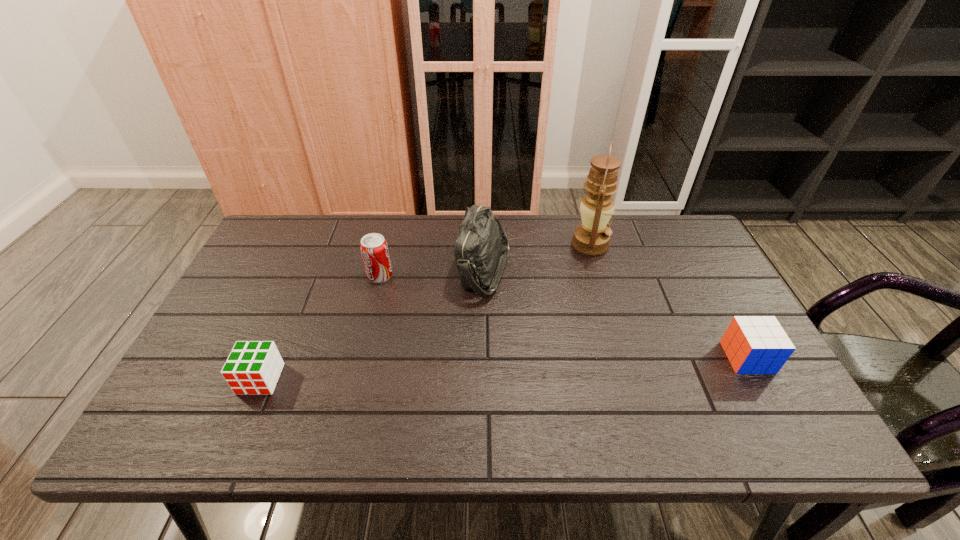
The image size is (960, 540). What are the coordinates of `the tallest object` in the screenshot? It's located at (592, 237).

At what (x,y) coordinates should I click in order to perform the action: click on oil lamp. Please return your answer as a coordinate pair (x, y). Image resolution: width=960 pixels, height=540 pixels. Looking at the image, I should click on (x=592, y=237).

This screenshot has height=540, width=960. Identify the location of the third object from left to right. point(481,250).

Where is `the fourth shortest object`? The image size is (960, 540). the fourth shortest object is located at coordinates (481, 250).

You are a GUI agent. You are given a task and a screenshot of the screen. Output one action in this format:
    pyautogui.click(x=<x>, y=<y>)
    Task: Click on the fourth object from right to left
    
    Given the screenshot: What is the action you would take?
    pyautogui.click(x=374, y=250)

Find the location of a particular element. This screenshot has width=960, height=540. the third shortest object is located at coordinates (374, 250).

The height and width of the screenshot is (540, 960). Identify the location of the right cube. [x=753, y=344].

This screenshot has height=540, width=960. What are the coordinates of `the left cube` in the screenshot? It's located at (x=253, y=368).

The image size is (960, 540). Identify the location of vacant space located 0.350m on the front of the fourth object from left to right. (622, 356).

Where is `vacant space situated at the front padded panel of the shoulder bag`? The height and width of the screenshot is (540, 960). vacant space situated at the front padded panel of the shoulder bag is located at coordinates (434, 270).